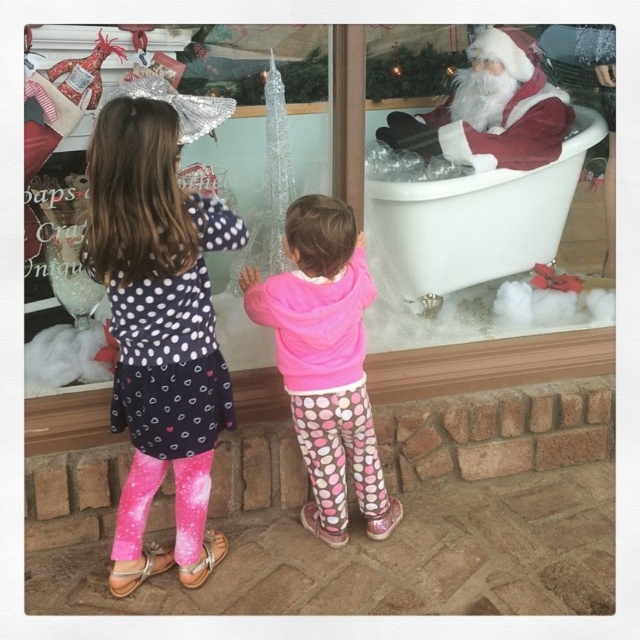
How much distance is there between pink glitter leggings at left and pink polka dot pants at center?

pink glitter leggings at left and pink polka dot pants at center are 12.36 inches apart.

Does pink glitter leggings at left appear over pink polka dot pants at center?

Yes, pink glitter leggings at left is above pink polka dot pants at center.

Is point (150, 180) in front of point (337, 387)?

That is True.

You are a GUI agent. You are given a task and a screenshot of the screen. Output one action in this format:
    pyautogui.click(x=<x>, y=<y>)
    Task: Click on the pink glitter leggings at left
    Image resolution: width=640 pixels, height=640 pixels.
    Given the screenshot: What is the action you would take?
    pyautogui.click(x=160, y=321)

Is point (305, 336) in front of point (513, 260)?

That is True.

Which is in front, point (326, 378) or point (522, 198)?

Point (326, 378) is more forward.

Locate an element on the screen. The image size is (640, 640). pink polka dot pants at center is located at coordinates (324, 362).

Does pink polka dot pants at center appear on the left side of velvet santa claus at right?

Correct, you'll find pink polka dot pants at center to the left of velvet santa claus at right.

Between pink polka dot pants at center and velvet santa claus at right, which one is positioned lower?

Positioned lower is pink polka dot pants at center.

Is point (300, 288) less distant than point (493, 33)?

Yes, it is in front of point (493, 33).

You are a GUI agent. You are given a task and a screenshot of the screen. Output one action in this format:
    pyautogui.click(x=<x>, y=<y>)
    Task: Click on the pink polka dot pants at center
    
    Given the screenshot: What is the action you would take?
    pyautogui.click(x=324, y=362)